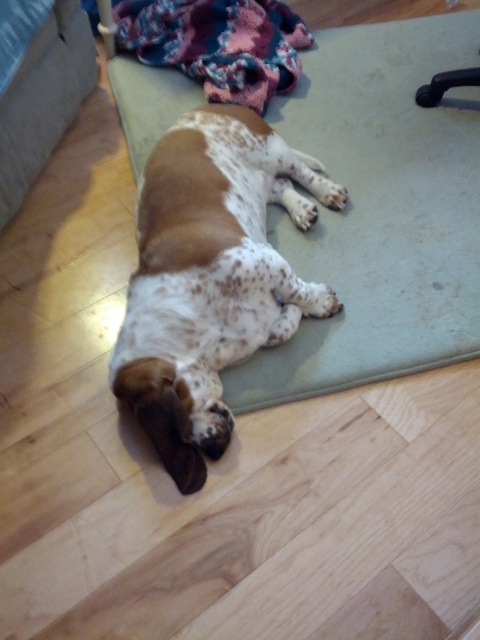
From the picture: You are standing in a room with a wooden floor and see a point at coordinates (380, 211). Is that point located on the green rubber yoga mat at center?

Yes, the point (380, 211) is on the green rubber yoga mat at center.

You are a photographer setting up a shoot in this scene. You want to ensure the speckled fur dog at center is fully visible in the photo. Should you adjust the position of the green rubber yoga mat at center, and why?

Yes, you should adjust the position of the green rubber yoga mat at center because the speckled fur dog at center is currently behind it, so moving the mat will allow the dog to be fully visible.

You are standing in a room and see the green rubber yoga mat at center. If you want to reach it without moving your feet, can you touch it with your outstretched hand?

The green rubber yoga mat at center is 1.38 meters from viewer. Since the average arm length is about 0.7 meters, you cannot reach it without moving closer.